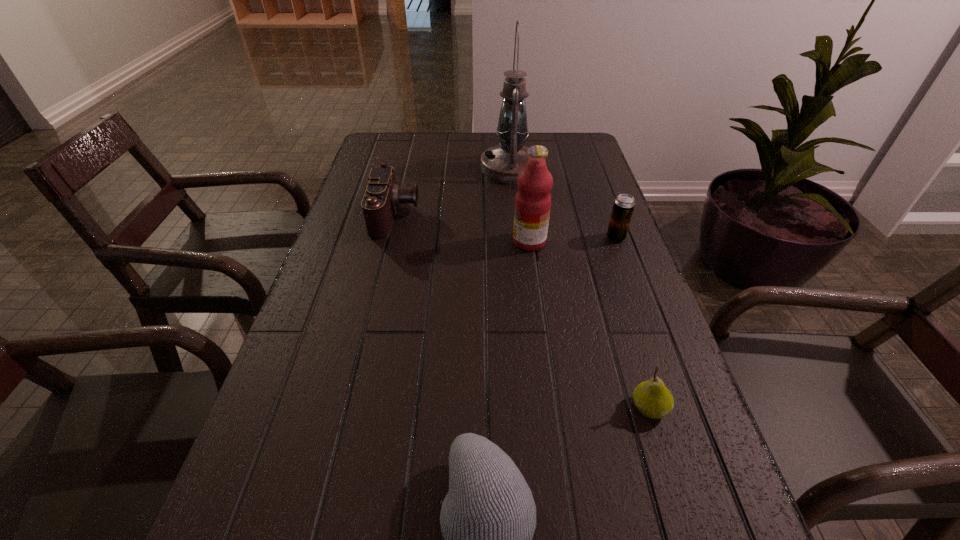
Find the location of a particular element. The height and width of the screenshot is (540, 960). free point located 0.110m on the left of the beer can is located at coordinates (x=563, y=238).

Locate an element on the screen. free space located 0.140m on the front-facing side of the leftmost object is located at coordinates (471, 215).

Image resolution: width=960 pixels, height=540 pixels. Identify the location of vacant space located 0.340m on the back of the pear. pos(605,265).

The width and height of the screenshot is (960, 540). I want to click on object present at the far edge, so click(x=502, y=163).

The width and height of the screenshot is (960, 540). I want to click on object at the left edge, so click(x=382, y=197).

Locate an element on the screen. This screenshot has width=960, height=540. beer can that is at the right edge is located at coordinates (624, 204).

Locate an element on the screen. The height and width of the screenshot is (540, 960). pear situated at the right edge is located at coordinates (652, 398).

In the image, there is a desktop. In order to click on free region at the far edge in this screenshot , I will do `click(442, 151)`.

In the image, there is a desktop. In order to click on vacant region at the left edge in this screenshot , I will do `click(343, 290)`.

In the image, there is a desktop. Identify the location of vacant space at the right edge. (687, 453).